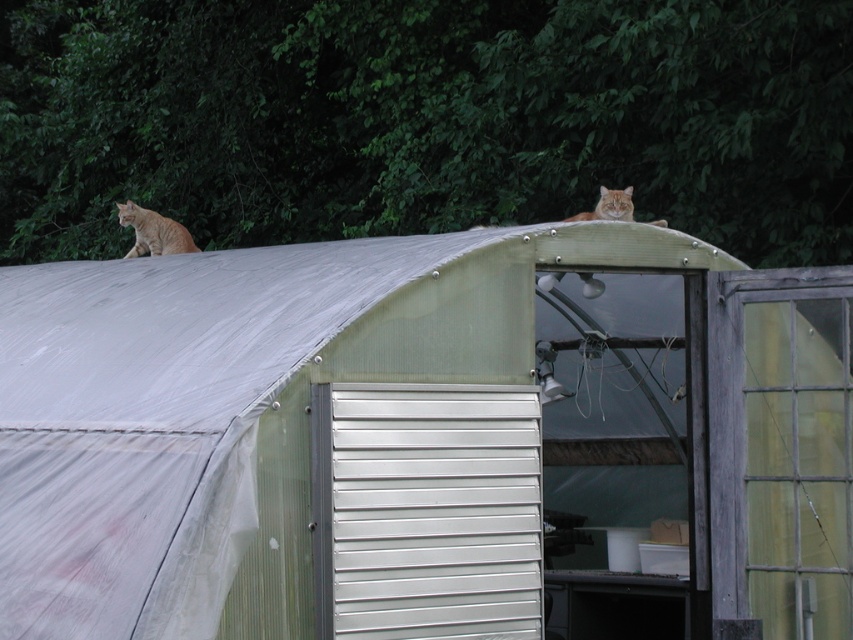
You are standing outside the greenhouse and want to reach the metallic silver hut at center. There is an orange fur cat at upper center on the roof. Which object is closer to you as you approach the greenhouse?

The metallic silver hut at center is closer to the viewer than the orange fur cat at upper center, so the metallic silver hut at center is closer to you as you approach the greenhouse.

You are standing outside the greenhouse and want to place a small potted plant on the metallic silver hut at center. However, there is an orange fur cat at left sitting above it. Can you safely place the plant there without disturbing the cat?

The metallic silver hut at center is positioned under the orange fur cat at left, so placing the plant there might disturb the cat since it is directly below the cat.